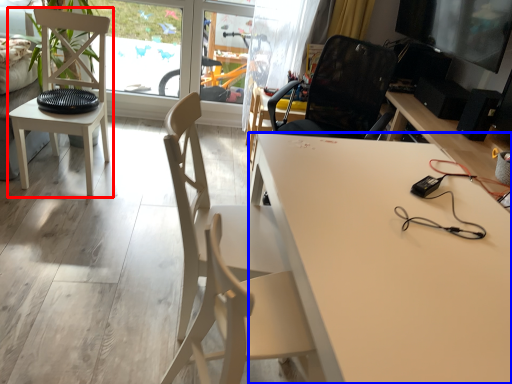
Question: Which of the following is the closest to the observer, chair (highlighted by a red box) or desk (highlighted by a blue box)?

Choices:
 (A) chair
 (B) desk

Answer: (B)